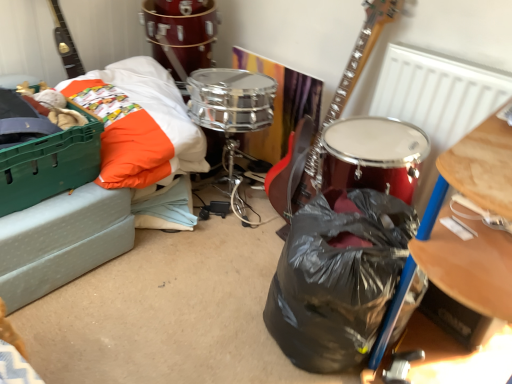
Question: Looking at their shapes, would you say shiny metallic drum at upper center is wider or thinner than black plastic bag at center?

Choices:
 (A) wide
 (B) thin

Answer: (A)

Question: Is point (201, 21) positioned closer to the camera than point (413, 228)?

Choices:
 (A) farther
 (B) closer

Answer: (A)

Question: Which is farther from the green plastic crate at left?

Choices:
 (A) shiny metallic drum at upper center
 (B) black plastic bag at center

Answer: (B)

Question: Which of these objects is positioned farthest from the black plastic bag at center?

Choices:
 (A) shiny metallic drum at upper center
 (B) green plastic crate at left

Answer: (A)